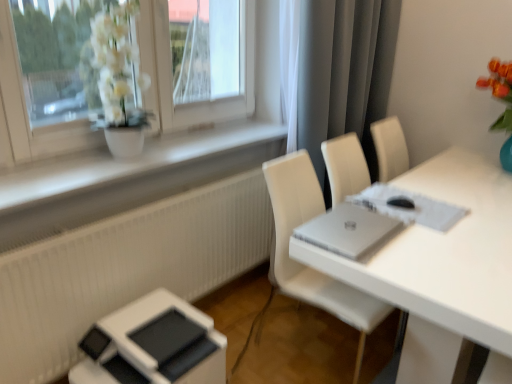
Question: From the image's perspective, is white matte window sill at upper left below gray matte curtain at upper right?

Choices:
 (A) yes
 (B) no

Answer: (A)

Question: Considering the relative sizes of white matte window sill at upper left and gray matte curtain at upper right in the image provided, is white matte window sill at upper left wider than gray matte curtain at upper right?

Choices:
 (A) yes
 (B) no

Answer: (A)

Question: Is white matte window sill at upper left taller than gray matte curtain at upper right?

Choices:
 (A) no
 (B) yes

Answer: (A)

Question: Is white matte window sill at upper left smaller than gray matte curtain at upper right?

Choices:
 (A) yes
 (B) no

Answer: (A)

Question: Would you say white matte window sill at upper left is outside gray matte curtain at upper right?

Choices:
 (A) no
 (B) yes

Answer: (B)

Question: Would you say white leather chair at right is inside or outside gray matte curtain at upper right?

Choices:
 (A) inside
 (B) outside

Answer: (B)

Question: In terms of size, does white leather chair at right appear bigger or smaller than gray matte curtain at upper right?

Choices:
 (A) big
 (B) small

Answer: (B)

Question: Considering the positions of point (285, 249) and point (304, 96), is point (285, 249) closer or farther from the camera than point (304, 96)?

Choices:
 (A) farther
 (B) closer

Answer: (B)

Question: Looking at their shapes, would you say white leather chair at right is wider or thinner than gray matte curtain at upper right?

Choices:
 (A) wide
 (B) thin

Answer: (A)

Question: From their relative heights in the image, would you say white glossy table at center is taller or shorter than white matte window sill at upper left?

Choices:
 (A) tall
 (B) short

Answer: (A)

Question: Based on their sizes in the image, would you say white glossy table at center is bigger or smaller than white matte window sill at upper left?

Choices:
 (A) big
 (B) small

Answer: (A)

Question: Visually, is white glossy table at center positioned to the left or to the right of white matte window sill at upper left?

Choices:
 (A) right
 (B) left

Answer: (A)

Question: From a real-world perspective, is white glossy table at center positioned above or below white matte window sill at upper left?

Choices:
 (A) above
 (B) below

Answer: (B)

Question: Does point (484, 203) appear closer or farther from the camera than point (390, 24)?

Choices:
 (A) closer
 (B) farther

Answer: (A)

Question: From their relative heights in the image, would you say white glossy table at center is taller or shorter than gray matte curtain at upper right?

Choices:
 (A) short
 (B) tall

Answer: (A)